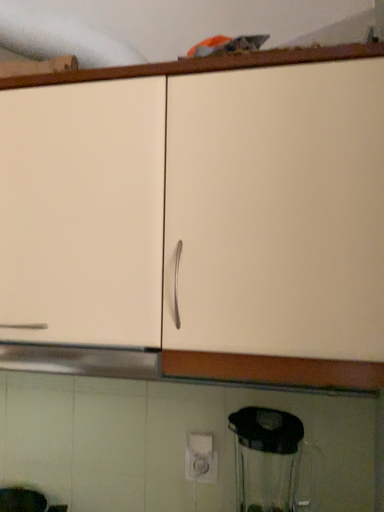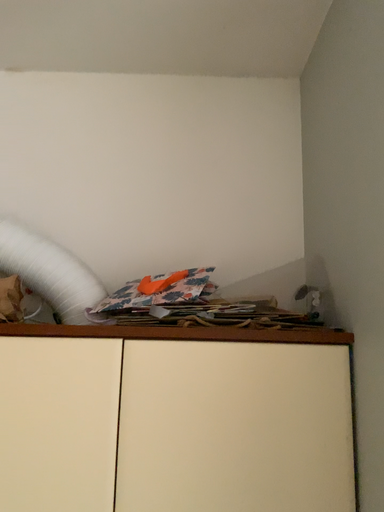
Question: How did the camera likely rotate when shooting the video?

Choices:
 (A) rotated left
 (B) rotated right

Answer: (B)